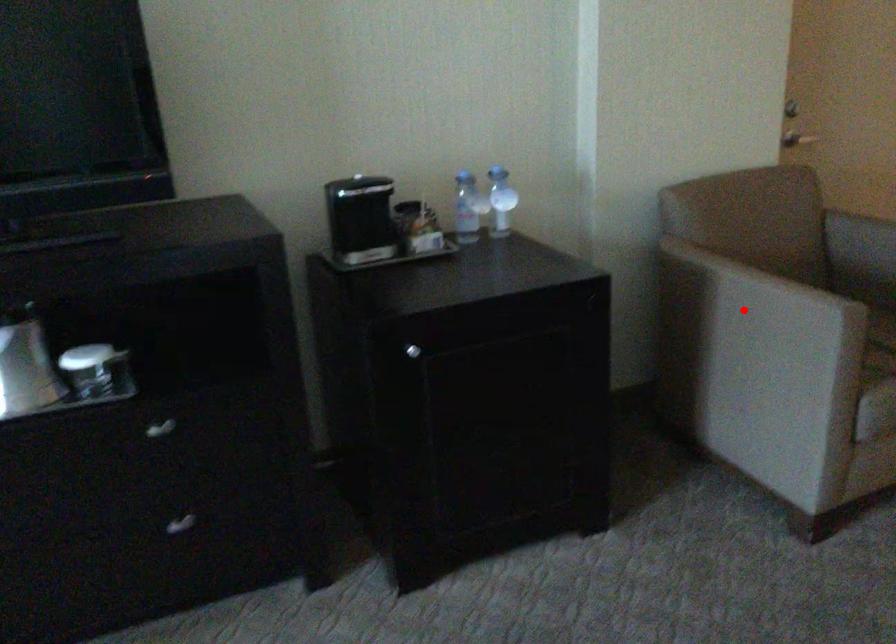
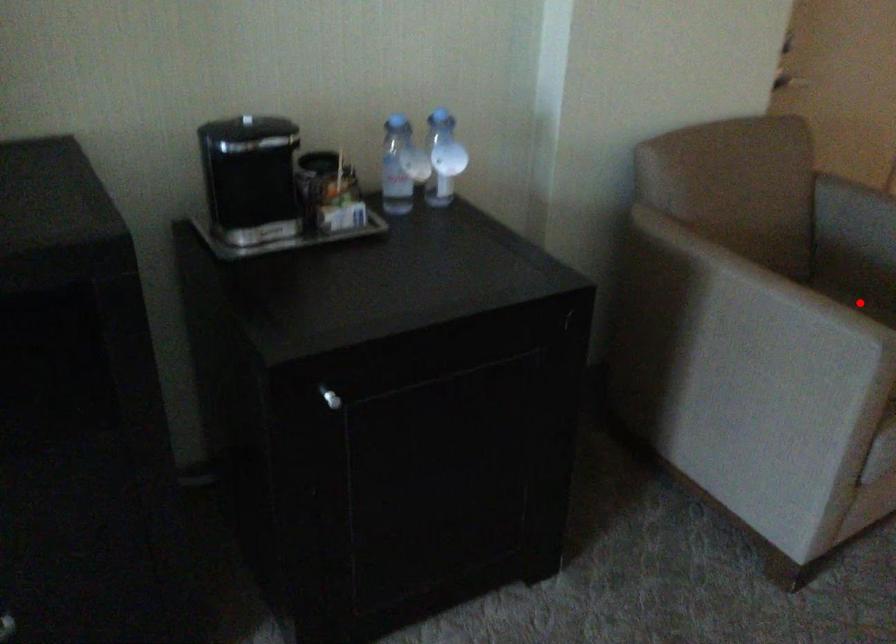
I am providing you with two images of the same scene from different viewpoints. A red point is marked on the first image and another point is marked on the second image. Are the points marked in image1 and image2 representing the same 3D position?

No